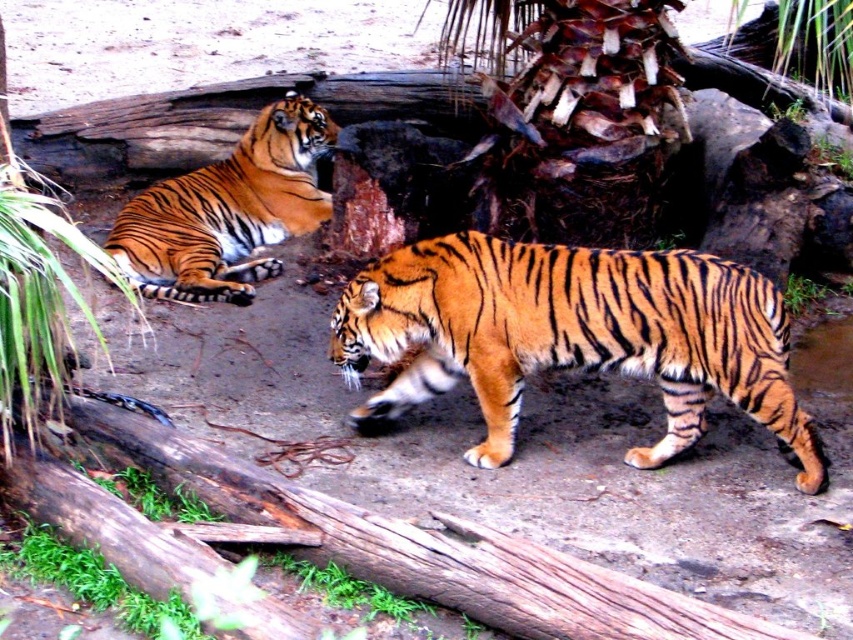
You are observing two tigers in a zoo enclosure. You see an orange striped tiger at center and another tiger in the background. Which tiger is closer to you?

The orange striped tiger at center is closer to you because it is positioned at point (573, 336), which is closer to the viewer compared to the background tiger.